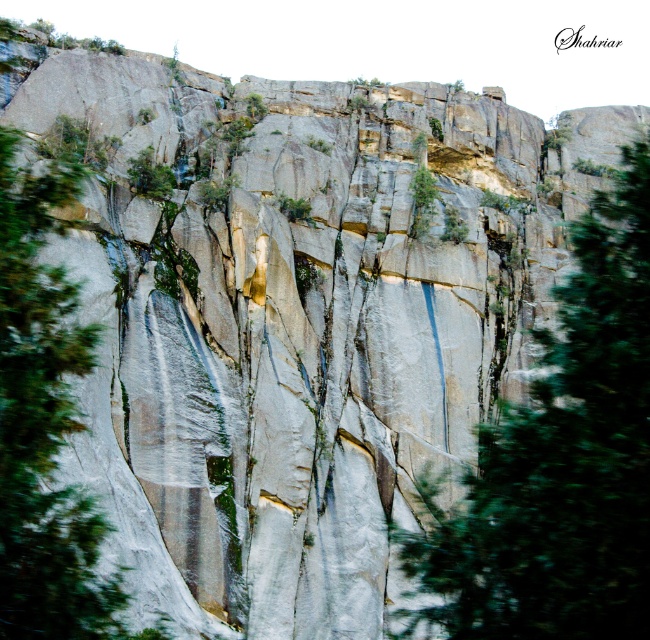
Can you confirm if green leafy tree at center is positioned to the right of green leafy tree at left?

Indeed, green leafy tree at center is positioned on the right side of green leafy tree at left.

The height and width of the screenshot is (640, 650). What do you see at coordinates (562, 460) in the screenshot?
I see `green leafy tree at center` at bounding box center [562, 460].

Identify the location of green leafy tree at center. This screenshot has width=650, height=640. (562, 460).